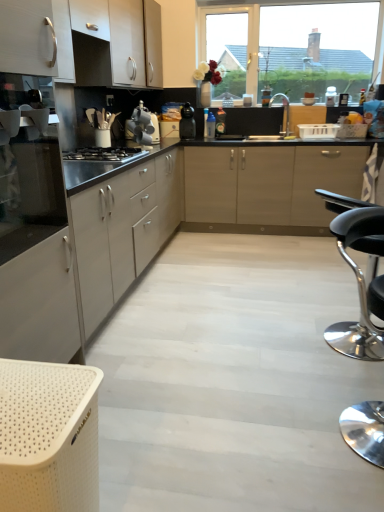
Question: Considering the relative positions of black matte gas stove at center and satin silver kettle at center, arranged as the 1th kitchen appliance when viewed from the front, in the image provided, is black matte gas stove at center to the right of satin silver kettle at center, arranged as the 1th kitchen appliance when viewed from the front, from the viewer's perspective?

Choices:
 (A) yes
 (B) no

Answer: (B)

Question: Is satin silver kettle at center, the 2th kitchen appliance viewed from the right, inside black matte gas stove at center?

Choices:
 (A) no
 (B) yes

Answer: (A)

Question: Does black matte gas stove at center turn towards satin silver kettle at center, the 2th kitchen appliance viewed from the right?

Choices:
 (A) yes
 (B) no

Answer: (B)

Question: Does black matte gas stove at center have a lesser height compared to satin silver kettle at center, the 2th kitchen appliance viewed from the right?

Choices:
 (A) no
 (B) yes

Answer: (B)

Question: Is black matte gas stove at center at the left side of satin silver kettle at center, the 2th kitchen appliance viewed from the right?

Choices:
 (A) yes
 (B) no

Answer: (A)

Question: In the image, is transparent glass window at upper center on the left side or the right side of black matte coffee maker at center, placed as the first kitchen appliance when sorted from back to front?

Choices:
 (A) left
 (B) right

Answer: (B)

Question: Considering the positions of point (337, 69) and point (190, 116), is point (337, 69) closer or farther from the camera than point (190, 116)?

Choices:
 (A) farther
 (B) closer

Answer: (A)

Question: From a real-world perspective, is transparent glass window at upper center physically located above or below black matte coffee maker at center, placed as the first kitchen appliance when sorted from back to front?

Choices:
 (A) below
 (B) above

Answer: (B)

Question: In terms of size, does transparent glass window at upper center appear bigger or smaller than black matte coffee maker at center, the second kitchen appliance when ordered from front to back?

Choices:
 (A) small
 (B) big

Answer: (B)

Question: Is silver metallic faucet at center inside or outside of black matte gas stove at center?

Choices:
 (A) inside
 (B) outside

Answer: (B)

Question: Considering the positions of point (279, 93) and point (107, 159), is point (279, 93) closer or farther from the camera than point (107, 159)?

Choices:
 (A) farther
 (B) closer

Answer: (A)

Question: From a real-world perspective, is silver metallic faucet at center physically located above or below black matte gas stove at center?

Choices:
 (A) above
 (B) below

Answer: (A)

Question: Is silver metallic faucet at center to the left or to the right of black matte gas stove at center in the image?

Choices:
 (A) left
 (B) right

Answer: (B)

Question: From their relative heights in the image, would you say black leather stool at lower right is taller or shorter than black matte coffee maker at center, placed as the first kitchen appliance when sorted from back to front?

Choices:
 (A) tall
 (B) short

Answer: (A)

Question: Based on their positions, is black leather stool at lower right located to the left or right of black matte coffee maker at center, the second kitchen appliance from the left?

Choices:
 (A) right
 (B) left

Answer: (A)